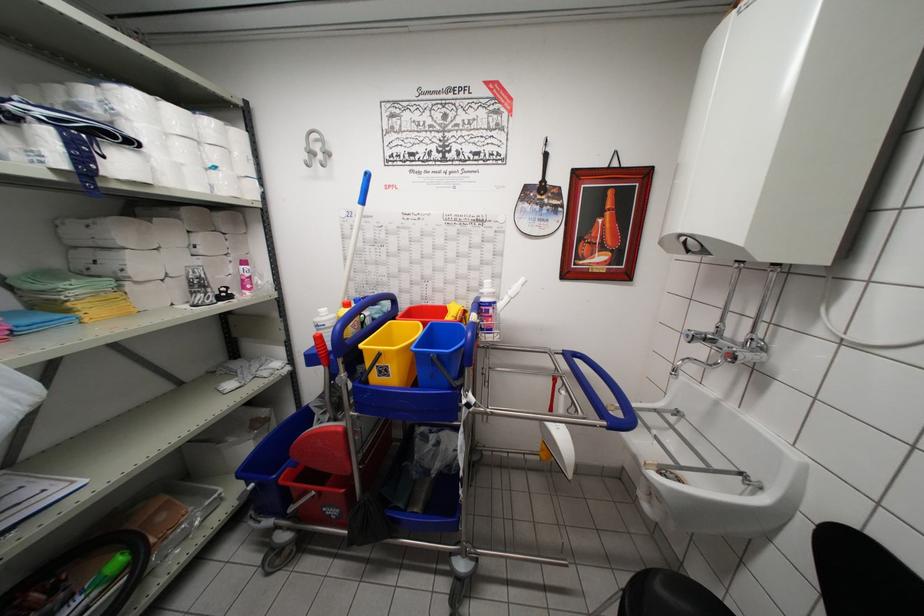
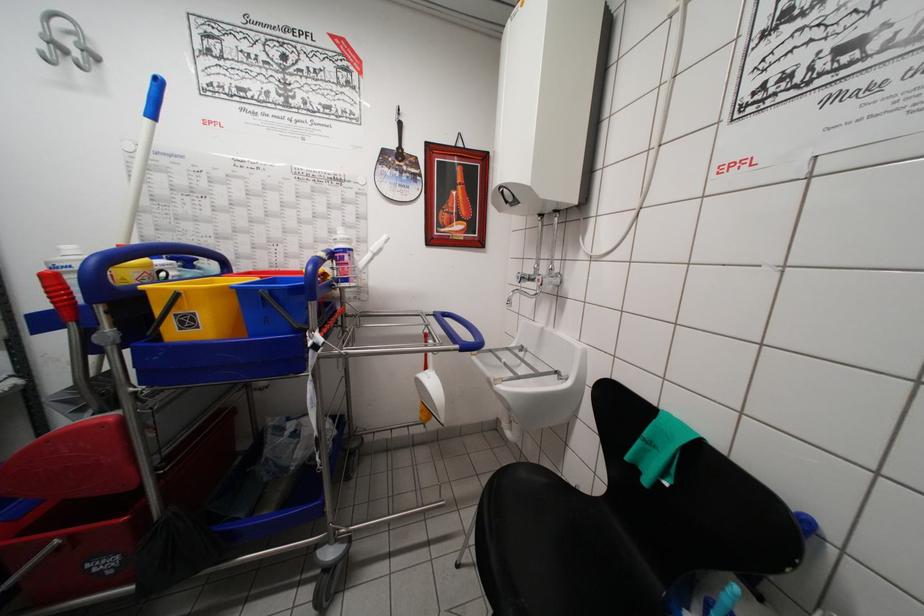
Question: Which direction would the cameraman need to move to produce the second image? Reply with the corresponding letter.

Choices:
 (A) Left
 (B) Right
 (C) Forward
 (D) Backward

Answer: (B)